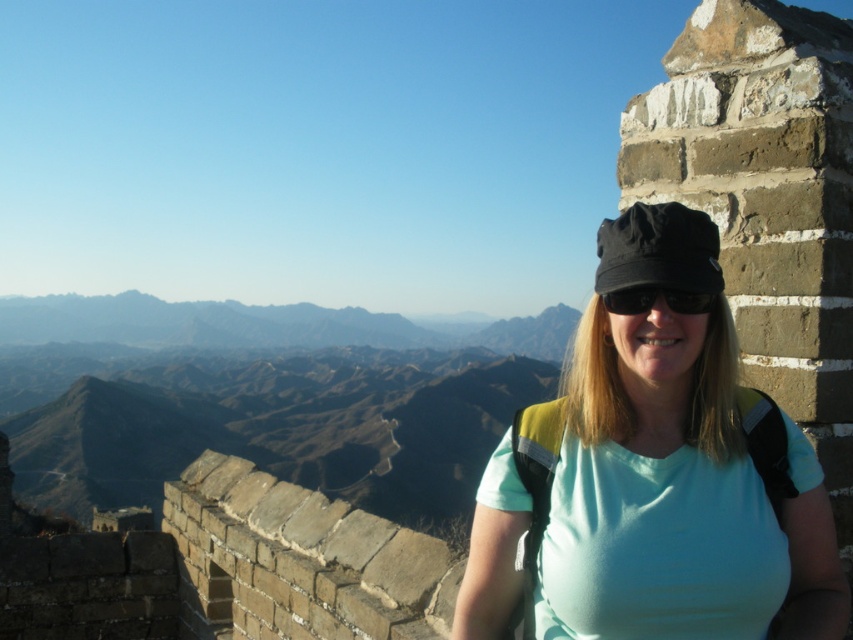
Is matte black cap at upper right bigger than black matte sunglasses at center?

Indeed, matte black cap at upper right has a larger size compared to black matte sunglasses at center.

Which is below, matte black cap at upper right or black matte sunglasses at center?

matte black cap at upper right is lower down.

Who is more forward, (657,429) or (639,307)?

Positioned in front is point (639,307).

The height and width of the screenshot is (640, 853). I want to click on matte black cap at upper right, so click(674, 467).